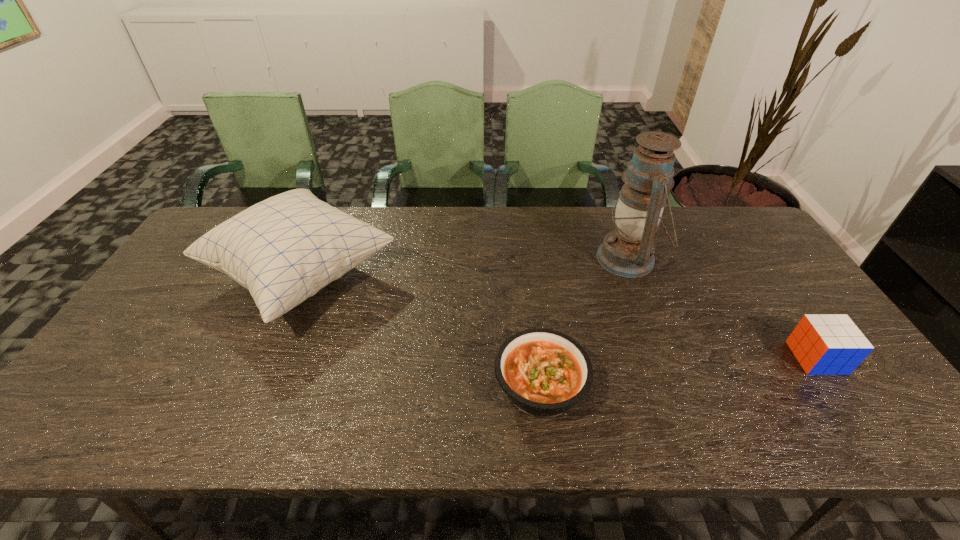
Where is `free space that satisfies the following two spatial constraints: 1. on the back side of the cushion; 2. on the left side of the tallest object`? free space that satisfies the following two spatial constraints: 1. on the back side of the cushion; 2. on the left side of the tallest object is located at coordinates (309, 259).